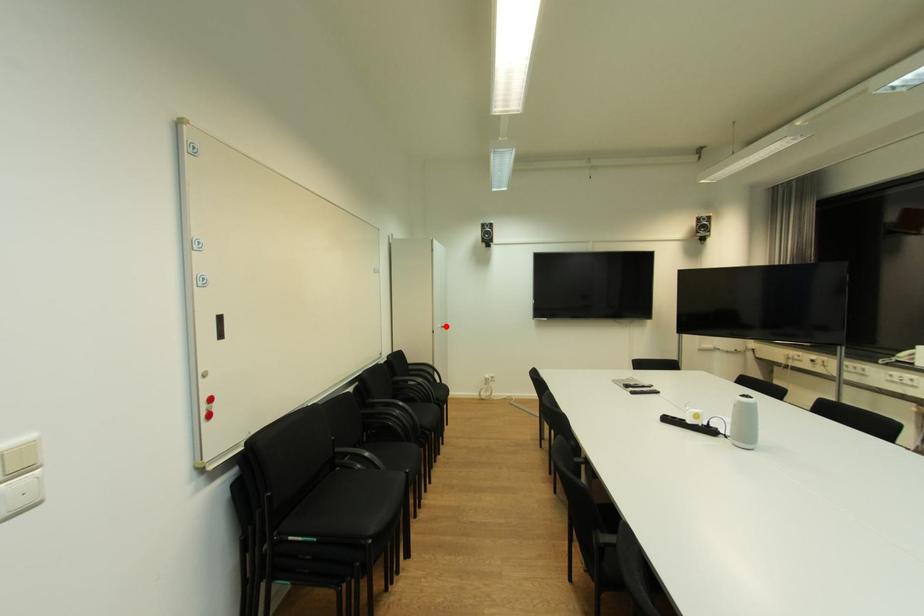
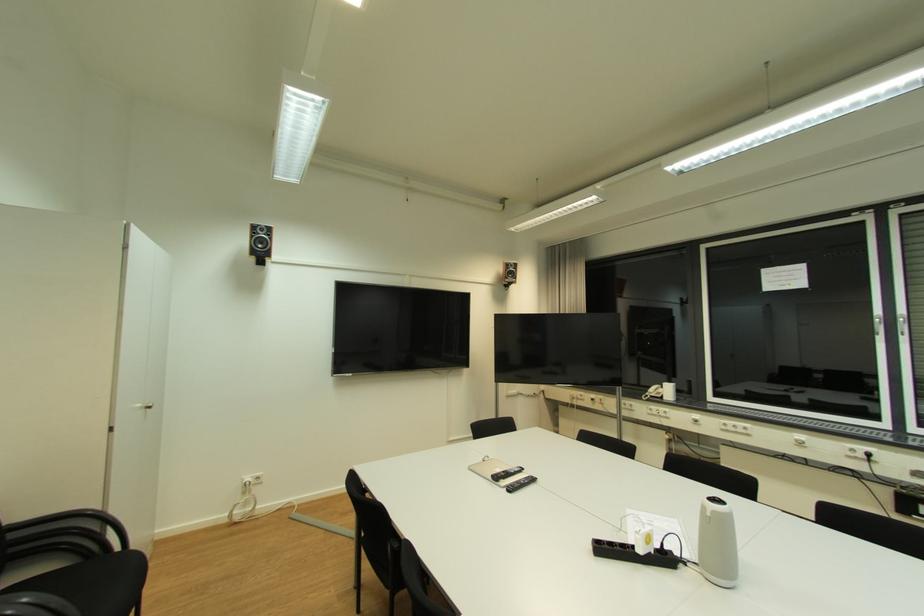
The point at the highlighted location is marked in the first image. Where is the corresponding point in the second image?

(146, 407)